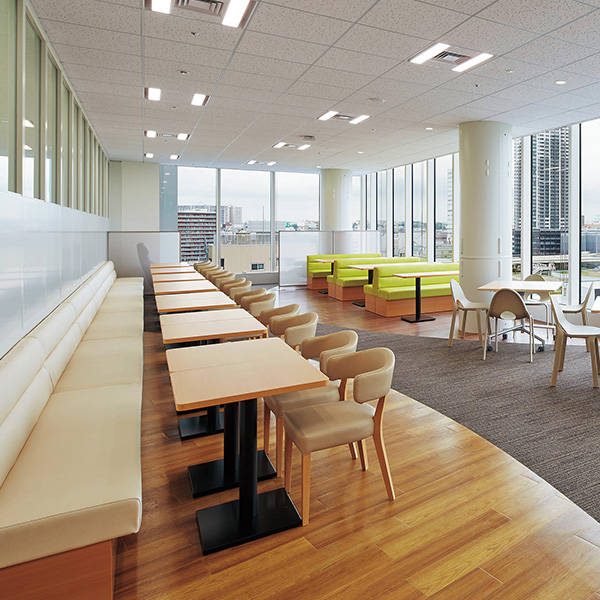
Locate an element on the screen. bench seats is located at coordinates (56, 425), (384, 285), (354, 276), (319, 272), (327, 279), (367, 290).